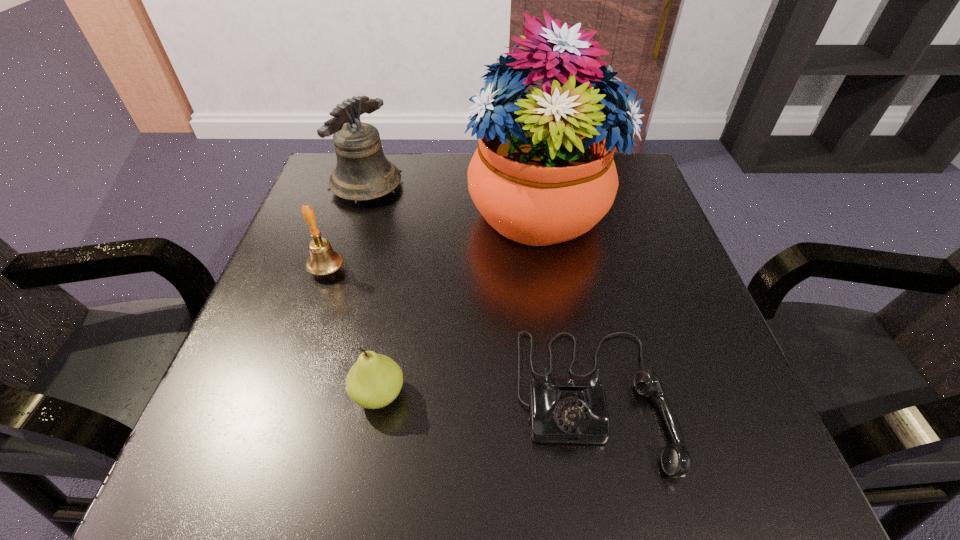
Where is `vacant point at the near edge`? Image resolution: width=960 pixels, height=540 pixels. vacant point at the near edge is located at coordinates (420, 476).

In the image, there is a desktop. Where is `vacant space at the left edge`? vacant space at the left edge is located at coordinates (308, 289).

The height and width of the screenshot is (540, 960). What are the coordinates of `free space at the right edge of the desktop` in the screenshot? It's located at (668, 249).

Identify the location of free space at the far left corner of the desktop. This screenshot has width=960, height=540. (324, 200).

This screenshot has width=960, height=540. Find the location of `vacant space at the near left corner of the desktop`. vacant space at the near left corner of the desktop is located at coordinates (253, 450).

Locate an element on the screen. free space at the far right corner of the desktop is located at coordinates (636, 166).

Locate an element on the screen. This screenshot has height=540, width=960. free space between the pear and the telephone is located at coordinates (486, 397).

This screenshot has width=960, height=540. Identify the location of vacant area that lies between the third tallest object and the flower arrangement. (433, 240).

Locate an element on the screen. empty space between the farther bell and the third tallest object is located at coordinates (347, 227).

The width and height of the screenshot is (960, 540). Find the location of `free space between the flower arrangement and the shorter bell`. free space between the flower arrangement and the shorter bell is located at coordinates (433, 240).